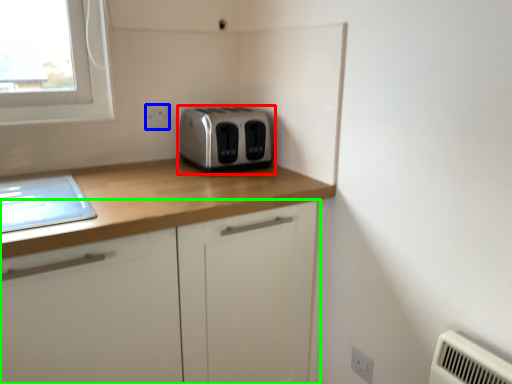
Question: Which object is the closest to the toaster (highlighted by a red box)? Choose among these: electric outlet (highlighted by a blue box) or cabinetry (highlighted by a green box).

Choices:
 (A) electric outlet
 (B) cabinetry

Answer: (A)